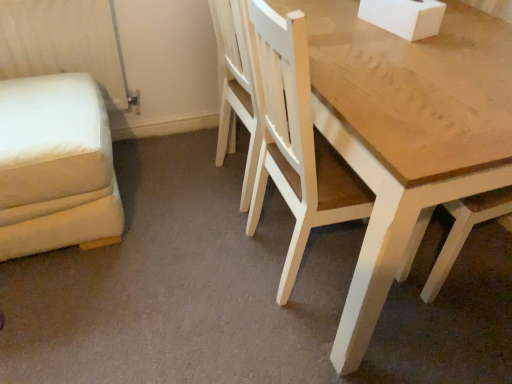
Question: Based on their sizes in the image, would you say white fabric swivel chair at left is bigger or smaller than light wood chair at center?

Choices:
 (A) small
 (B) big

Answer: (A)

Question: Does point (73, 134) appear closer or farther from the camera than point (353, 203)?

Choices:
 (A) closer
 (B) farther

Answer: (B)

Question: Is white fabric swivel chair at left in front of or behind light wood chair at center in the image?

Choices:
 (A) behind
 (B) front

Answer: (A)

Question: Is light wood chair at center bigger or smaller than white fabric swivel chair at left?

Choices:
 (A) small
 (B) big

Answer: (B)

Question: From their relative heights in the image, would you say light wood chair at center is taller or shorter than white fabric swivel chair at left?

Choices:
 (A) tall
 (B) short

Answer: (A)

Question: Relative to white fabric swivel chair at left, is light wood chair at center in front or behind?

Choices:
 (A) front
 (B) behind

Answer: (A)

Question: Do you think light wood chair at center is within white fabric swivel chair at left, or outside of it?

Choices:
 (A) inside
 (B) outside

Answer: (B)